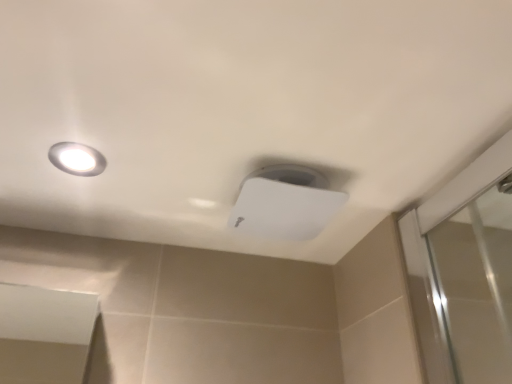
Question: Does white plastic lamp at upper center have a greater height compared to matte white droplight at upper left?

Choices:
 (A) yes
 (B) no

Answer: (A)

Question: From the image's perspective, is white plastic lamp at upper center above matte white droplight at upper left?

Choices:
 (A) yes
 (B) no

Answer: (B)

Question: Considering the relative positions of white plastic lamp at upper center and matte white droplight at upper left in the image provided, is white plastic lamp at upper center in front of matte white droplight at upper left?

Choices:
 (A) no
 (B) yes

Answer: (A)

Question: Considering the relative positions of white plastic lamp at upper center and matte white droplight at upper left in the image provided, is white plastic lamp at upper center behind matte white droplight at upper left?

Choices:
 (A) yes
 (B) no

Answer: (A)

Question: Are white plastic lamp at upper center and matte white droplight at upper left far apart?

Choices:
 (A) no
 (B) yes

Answer: (A)

Question: Is matte white droplight at upper left surrounded by white plastic lamp at upper center?

Choices:
 (A) no
 (B) yes

Answer: (A)

Question: Is matte white droplight at upper left not within white plastic lamp at upper center?

Choices:
 (A) no
 (B) yes

Answer: (B)

Question: Is the depth of matte white droplight at upper left less than that of white plastic lamp at upper center?

Choices:
 (A) yes
 (B) no

Answer: (A)

Question: From the image's perspective, is matte white droplight at upper left above white plastic lamp at upper center?

Choices:
 (A) no
 (B) yes

Answer: (B)

Question: Can you confirm if matte white droplight at upper left is positioned to the left of white plastic lamp at upper center?

Choices:
 (A) yes
 (B) no

Answer: (A)

Question: Could white plastic lamp at upper center be considered to be inside matte white droplight at upper left?

Choices:
 (A) no
 (B) yes

Answer: (A)

Question: From a real-world perspective, is matte white droplight at upper left positioned under white plastic lamp at upper center based on gravity?

Choices:
 (A) yes
 (B) no

Answer: (B)

Question: Is point (70, 153) closer or farther from the camera than point (254, 226)?

Choices:
 (A) closer
 (B) farther

Answer: (A)